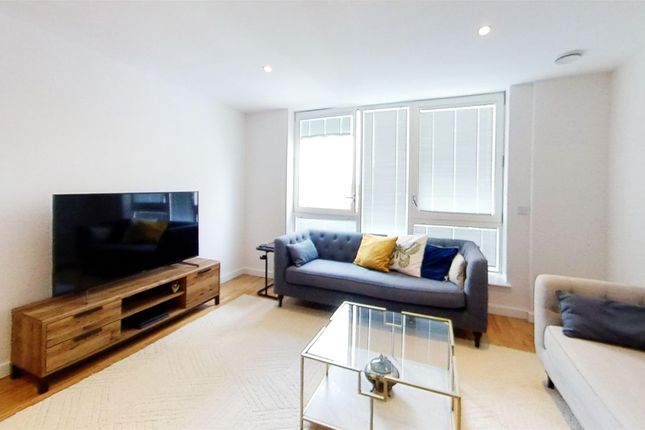
At what (x,y) coordinates should I click in order to perform the action: click on light. Please return your answer as a coordinate pair (x, y). This screenshot has width=645, height=430. Looking at the image, I should click on (266, 69), (482, 31).